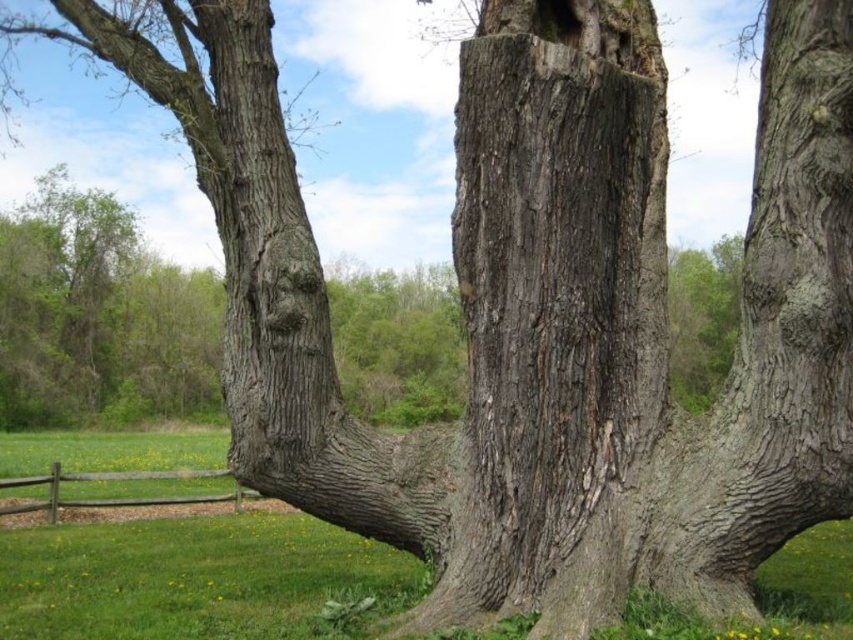
Question: Which of the following is the closest to the observer?

Choices:
 (A) gray rough bark tree trunk at center
 (B) brown wooden fence at lower left

Answer: (A)

Question: Is gray rough bark tree trunk at center below brown wooden fence at lower left?

Choices:
 (A) yes
 (B) no

Answer: (B)

Question: Is gray rough bark tree trunk at center to the right of brown wooden fence at lower left from the viewer's perspective?

Choices:
 (A) no
 (B) yes

Answer: (B)

Question: Does gray rough bark tree trunk at center have a lesser width compared to brown wooden fence at lower left?

Choices:
 (A) yes
 (B) no

Answer: (B)